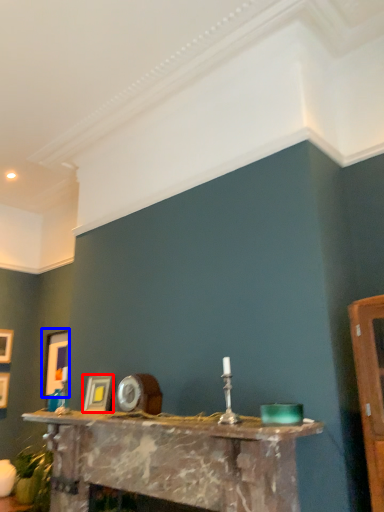
Question: Which point is further to the camera, picture frame (highlighted by a red box) or picture frame (highlighted by a blue box)?

Choices:
 (A) picture frame
 (B) picture frame

Answer: (B)